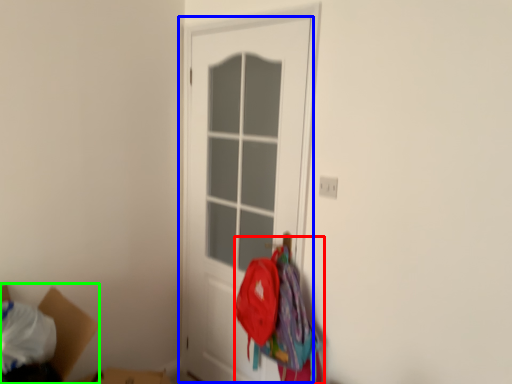
Question: Estimate the real-world distances between objects in this image. Which object is farther from laundry (highlighted by a red box), door (highlighted by a blue box) or cardboard box (highlighted by a green box)?

Choices:
 (A) door
 (B) cardboard box

Answer: (B)